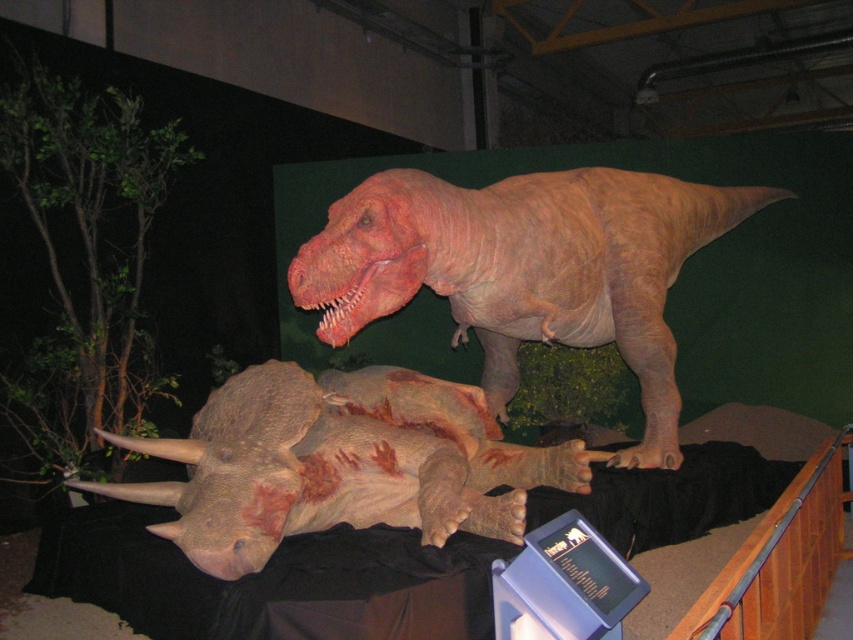
Question: Where is smooth tan dinosaur at upper center located in relation to brown textured dinosaur at lower center in the image?

Choices:
 (A) left
 (B) right

Answer: (B)

Question: Is smooth tan dinosaur at upper center wider than brown textured dinosaur at lower center?

Choices:
 (A) no
 (B) yes

Answer: (B)

Question: Where is smooth tan dinosaur at upper center located in relation to brown textured dinosaur at lower center in the image?

Choices:
 (A) below
 (B) above

Answer: (B)